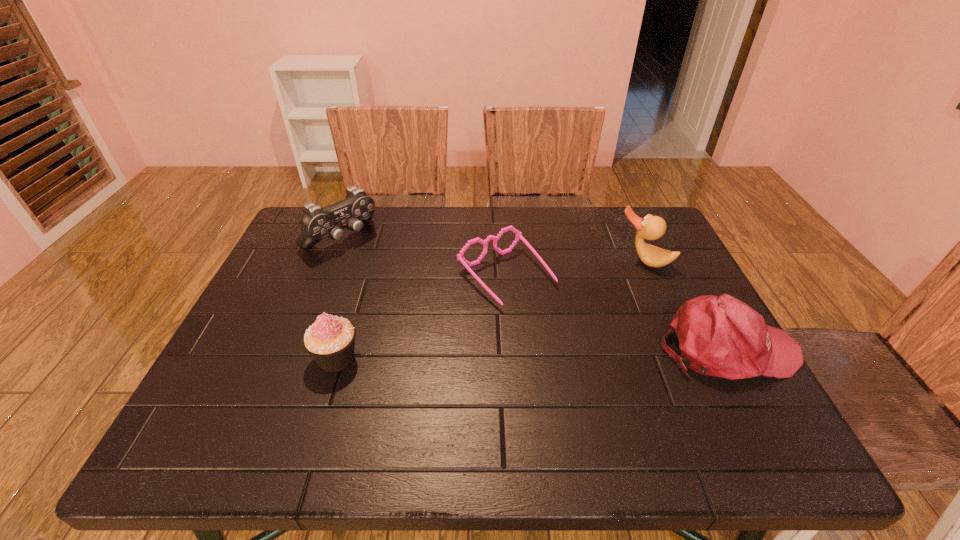
The width and height of the screenshot is (960, 540). I want to click on vacant space at the right edge of the desktop, so click(x=649, y=315).

In order to click on free space at the far left corner of the desktop in this screenshot , I will do `click(289, 238)`.

Find the location of a particular element. vacant area at the near left corner of the desktop is located at coordinates (224, 408).

The width and height of the screenshot is (960, 540). In the image, there is a desktop. What are the coordinates of `free space at the far right corner` in the screenshot? It's located at (633, 232).

Identify the location of empty space between the duck and the control. (492, 249).

Find the location of a particular element. The height and width of the screenshot is (540, 960). free spot between the control and the duck is located at coordinates (492, 249).

At what (x,y) coordinates should I click in order to perform the action: click on empty space that is in between the duck and the cupcake. Please return your answer as a coordinate pair (x, y). This screenshot has height=540, width=960. Looking at the image, I should click on (490, 309).

At what (x,y) coordinates should I click in order to perform the action: click on unoccupied area between the third object from right to left and the control. Please return your answer as a coordinate pair (x, y). The image size is (960, 540). Looking at the image, I should click on (423, 257).

Locate an element on the screen. free space between the shortest object and the baseball cap is located at coordinates (616, 312).

At what (x,y) coordinates should I click in order to perform the action: click on vacant space that's between the cupcake and the shortest object. Please return your answer as a coordinate pair (x, y). The width and height of the screenshot is (960, 540). Looking at the image, I should click on (421, 317).